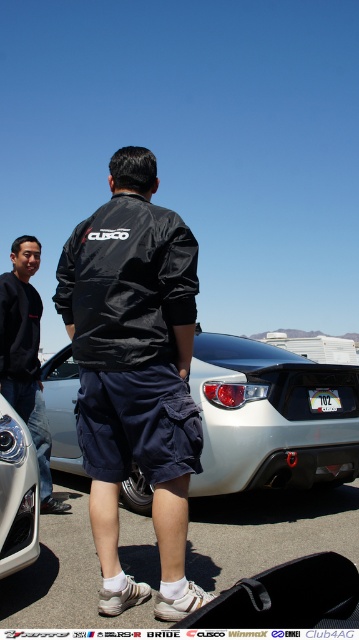
You are a photographer trying to capture the white matte car at center and the matte silver headlight at lower left in a single shot. Given that the camera can only focus on one object at a time, which object should you focus on to ensure the larger object is sharp?

The white matte car at center is larger than the matte silver headlight at lower left, so you should focus on the white matte car at center to ensure the larger object is sharp.

You are a photographer at a car event. You need to capture a photo that includes both the matte silver headlight at lower left and the white plastic license plate at rear. Which object should be placed higher in the frame to ensure both are visible?

The matte silver headlight at lower left is taller than the white plastic license plate at rear, so to ensure both are visible in the photo, the headlight should be placed higher in the frame to accommodate its greater height.

You are a photographer trying to capture both the black leather jacket at center and the matte silver headlight at lower left in a single shot. Considering their sizes, which object will appear bigger in the photo?

The black leather jacket at center will appear bigger in the photo because it is larger in size than the matte silver headlight at lower left.